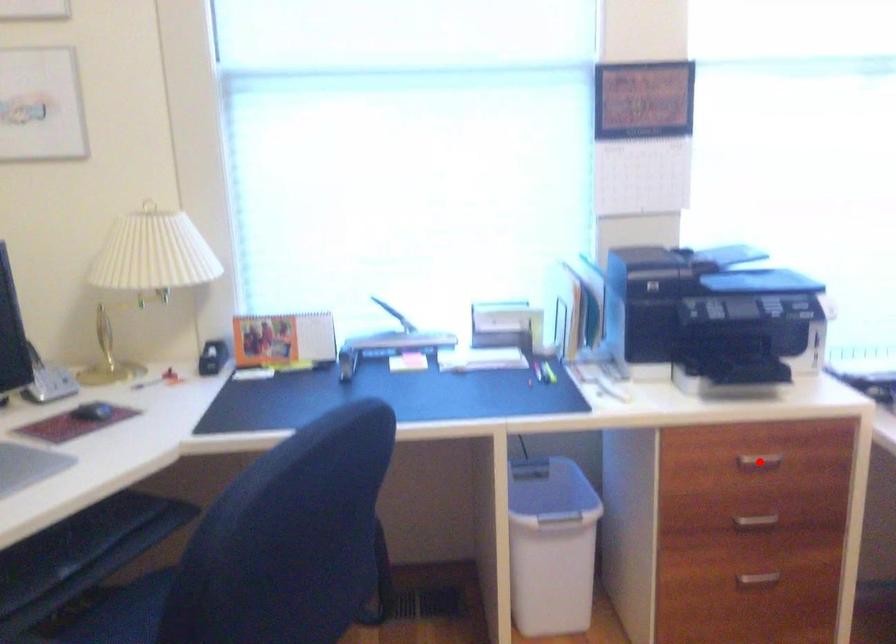
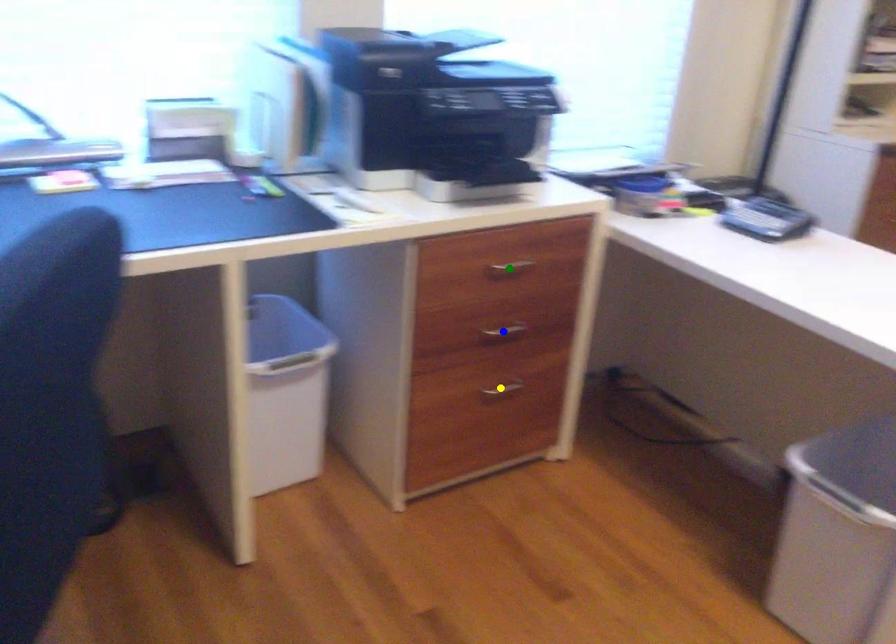
Question: I am providing you with two images of the same scene from different viewpoints. A red point is marked on the first image. You are given multiple points on the second image. Which spot in image 2 lines up with the point in image 1?

Choices:
 (A) green point
 (B) yellow point
 (C) blue point

Answer: (A)